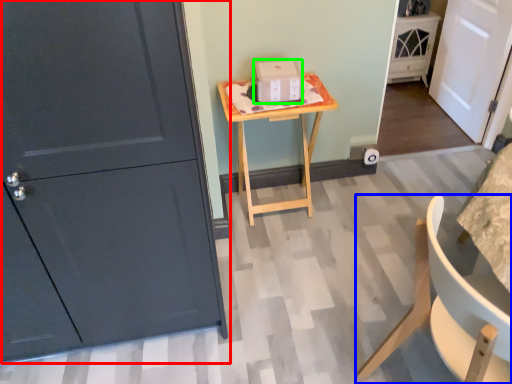
Question: Based on their relative distances, which object is farther from door (highlighted by a red box)? Choose from chair (highlighted by a blue box) and cardboard box (highlighted by a green box).

Choices:
 (A) chair
 (B) cardboard box

Answer: (B)